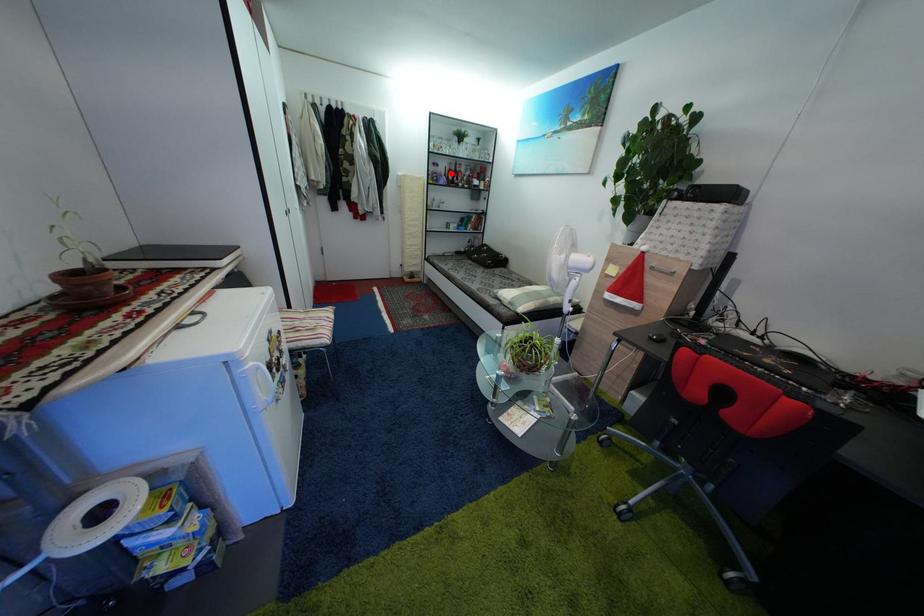
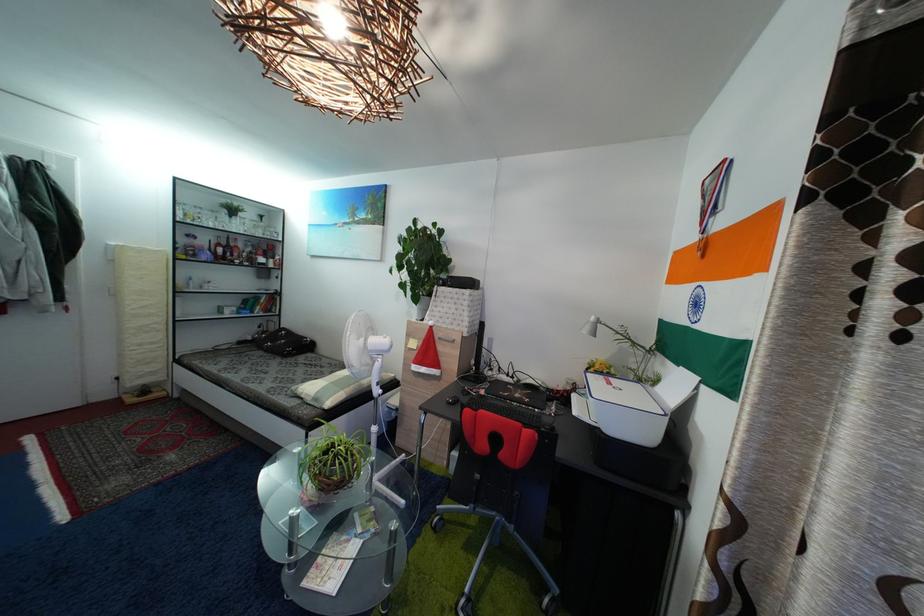
In the second image, find the point that corresponds to the highlighted location in the first image.

(213, 246)